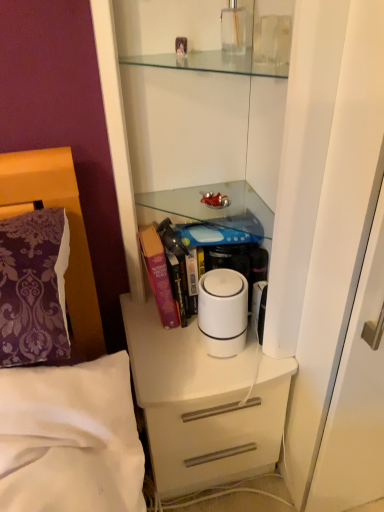
Question: From a real-world perspective, is purple hardcover book at center located beneath white matte chest of drawers at center?

Choices:
 (A) yes
 (B) no

Answer: (B)

Question: Is purple hardcover book at center positioned beyond the bounds of white matte chest of drawers at center?

Choices:
 (A) no
 (B) yes

Answer: (B)

Question: Does purple hardcover book at center have a smaller size compared to white matte chest of drawers at center?

Choices:
 (A) yes
 (B) no

Answer: (A)

Question: Does purple hardcover book at center have a lesser height compared to white matte chest of drawers at center?

Choices:
 (A) yes
 (B) no

Answer: (A)

Question: Does purple hardcover book at center have a larger size compared to white matte chest of drawers at center?

Choices:
 (A) no
 (B) yes

Answer: (A)

Question: From a real-world perspective, is white plastic humidifier at center positioned above or below white matte chest of drawers at center?

Choices:
 (A) below
 (B) above

Answer: (B)

Question: From the image's perspective, relative to white matte chest of drawers at center, is white plastic humidifier at center above or below?

Choices:
 (A) above
 (B) below

Answer: (A)

Question: In terms of size, does white plastic humidifier at center appear bigger or smaller than white matte chest of drawers at center?

Choices:
 (A) big
 (B) small

Answer: (B)

Question: Is white plastic humidifier at center in front of or behind white matte chest of drawers at center in the image?

Choices:
 (A) front
 (B) behind

Answer: (A)

Question: Looking at their shapes, would you say purple hardcover book at center is wider or thinner than white plastic humidifier at center?

Choices:
 (A) thin
 (B) wide

Answer: (B)

Question: Is purple hardcover book at center situated inside white plastic humidifier at center or outside?

Choices:
 (A) outside
 (B) inside

Answer: (A)

Question: Based on their sizes in the image, would you say purple hardcover book at center is bigger or smaller than white plastic humidifier at center?

Choices:
 (A) small
 (B) big

Answer: (B)

Question: Does point (178, 227) appear closer or farther from the camera than point (243, 337)?

Choices:
 (A) closer
 (B) farther

Answer: (B)

Question: From the image's perspective, is white matte chest of drawers at center positioned above or below purple hardcover book at center?

Choices:
 (A) below
 (B) above

Answer: (A)

Question: Is white matte chest of drawers at center bigger or smaller than purple hardcover book at center?

Choices:
 (A) big
 (B) small

Answer: (A)